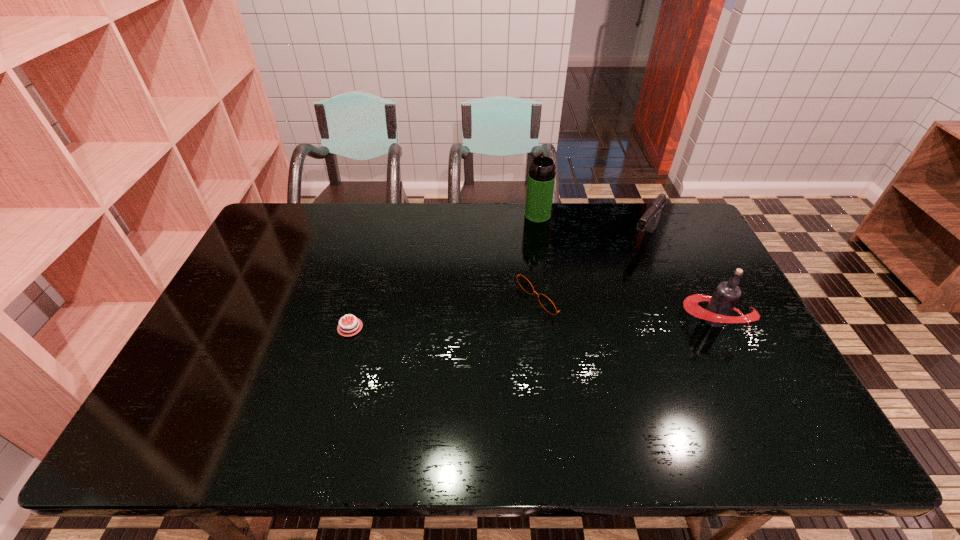
The image size is (960, 540). I want to click on free space located 0.130m aim along the barrel of the pistol, so click(621, 273).

Locate an element on the screen. free space located 0.140m aim along the barrel of the pistol is located at coordinates (620, 275).

Where is `blank space located from the spout of the farthest object`? This screenshot has height=540, width=960. blank space located from the spout of the farthest object is located at coordinates (516, 275).

Locate an element on the screen. The height and width of the screenshot is (540, 960). vacant area situated 0.380m from the spout of the farthest object is located at coordinates (509, 297).

You are a GUI agent. You are given a task and a screenshot of the screen. Output one action in this format:
    pyautogui.click(x=<x>, y=<y>)
    Task: Click on the vacant area located from the spout of the farthest object
    This screenshot has height=540, width=960.
    Given the screenshot: What is the action you would take?
    pyautogui.click(x=526, y=247)

Find the location of a particular element. This screenshot has height=540, width=960. blank space located 0.180m on the face of the second shortest object is located at coordinates (473, 335).

This screenshot has height=540, width=960. Identify the location of free point located on the face of the second shortest object. tap(458, 343).

Where is `vacant space situated 0.350m on the face of the second shortest object`? The width and height of the screenshot is (960, 540). vacant space situated 0.350m on the face of the second shortest object is located at coordinates (419, 365).

Locate an element on the screen. Image resolution: width=960 pixels, height=540 pixels. pistol present at the far edge is located at coordinates tap(649, 221).

I want to click on thermos bottle located at the far edge, so click(x=541, y=178).